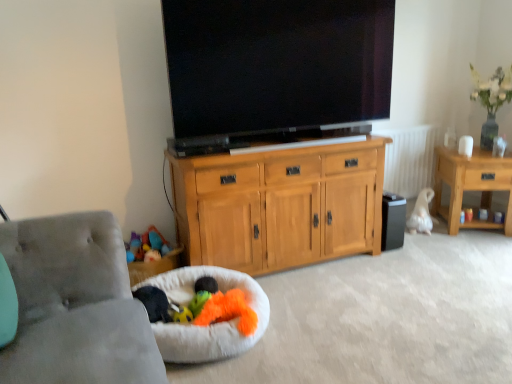
You are a GUI agent. You are given a task and a screenshot of the screen. Output one action in this format:
    pyautogui.click(x=<x>, y=<y>)
    Task: Click on the vacant space in white fluffy dog at right (from a real-world perspective)
    
    Given the screenshot: What is the action you would take?
    pyautogui.click(x=420, y=230)